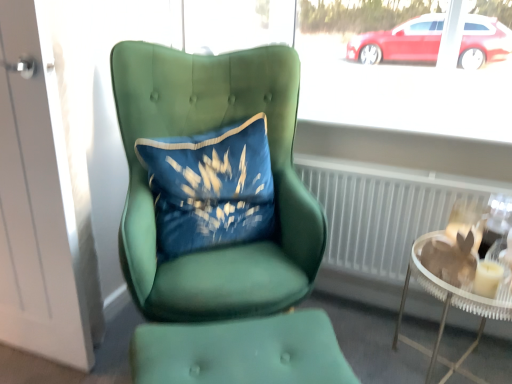
Question: From the image's perspective, is white matte door at left below green fabric footrest at lower center?

Choices:
 (A) no
 (B) yes

Answer: (A)

Question: Is white matte door at left not near green fabric footrest at lower center?

Choices:
 (A) yes
 (B) no

Answer: (B)

Question: Considering the relative sizes of white matte door at left and green fabric footrest at lower center in the image provided, is white matte door at left bigger than green fabric footrest at lower center?

Choices:
 (A) no
 (B) yes

Answer: (A)

Question: Is white matte door at left positioned with its back to green fabric footrest at lower center?

Choices:
 (A) no
 (B) yes

Answer: (A)

Question: Can you confirm if white matte door at left is positioned to the right of green fabric footrest at lower center?

Choices:
 (A) yes
 (B) no

Answer: (B)

Question: Is white matte door at left shorter than green fabric footrest at lower center?

Choices:
 (A) yes
 (B) no

Answer: (B)

Question: Is green fabric footrest at lower center surrounding velvet blue pillow at center?

Choices:
 (A) yes
 (B) no

Answer: (B)

Question: Is green fabric footrest at lower center smaller than velvet blue pillow at center?

Choices:
 (A) no
 (B) yes

Answer: (B)

Question: Considering the relative sizes of green fabric footrest at lower center and velvet blue pillow at center in the image provided, is green fabric footrest at lower center bigger than velvet blue pillow at center?

Choices:
 (A) no
 (B) yes

Answer: (A)

Question: From the image's perspective, would you say green fabric footrest at lower center is positioned over velvet blue pillow at center?

Choices:
 (A) no
 (B) yes

Answer: (A)

Question: From a real-world perspective, is green fabric footrest at lower center positioned over velvet blue pillow at center based on gravity?

Choices:
 (A) no
 (B) yes

Answer: (A)

Question: Can you confirm if green fabric footrest at lower center is positioned to the right of velvet blue pillow at center?

Choices:
 (A) yes
 (B) no

Answer: (A)

Question: Does green fabric footrest at lower center have a smaller size compared to white matte door at left?

Choices:
 (A) no
 (B) yes

Answer: (A)